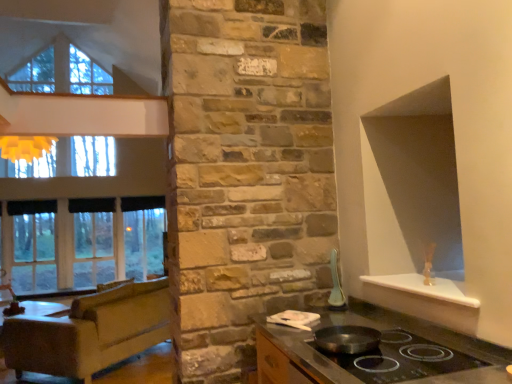
Question: Considering their positions, is clear glass window at left located in front of or behind shiny black countertop at lower center?

Choices:
 (A) behind
 (B) front

Answer: (A)

Question: Is clear glass window at left taller or shorter than shiny black countertop at lower center?

Choices:
 (A) short
 (B) tall

Answer: (B)

Question: Estimate the real-world distances between objects in this image. Which object is farther from the brown leather couch at left?

Choices:
 (A) clear glass window at left
 (B) shiny black countertop at lower center
 (C) black fabric curtain at left, the second curtain when ordered from left to right
 (D) white glossy spoon at upper right
 (E) shiny black wok at center

Answer: (E)

Question: Estimate the real-world distances between objects in this image. Which object is farther from the black fabric curtain at left, arranged as the 1th curtain when viewed from the back?

Choices:
 (A) white glossy spoon at upper right
 (B) shiny black wok at center
 (C) clear glass window at left
 (D) black fabric curtain at left, acting as the second curtain starting from the right
 (E) brown leather couch at left

Answer: (B)